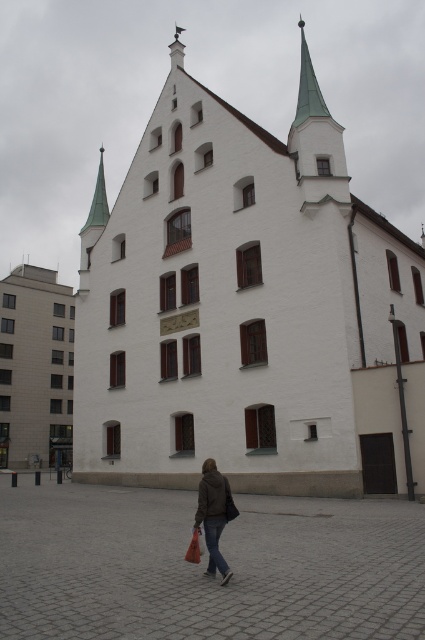
Question: Can you confirm if gray cobblestone square at center is positioned below brown leather jacket at lower center?

Choices:
 (A) yes
 (B) no

Answer: (A)

Question: Which of the following is the closest to the observer?

Choices:
 (A) white concrete building at left
 (B) gray cobblestone square at center
 (C) white stone church at center
 (D) brown leather jacket at lower center

Answer: (B)

Question: Which of these objects is positioned closest to the gray cobblestone square at center?

Choices:
 (A) white stone church at center
 (B) brown leather jacket at lower center
 (C) white concrete building at left

Answer: (B)

Question: Does white stone church at center appear on the left side of brown leather jacket at lower center?

Choices:
 (A) no
 (B) yes

Answer: (A)

Question: Is white stone church at center smaller than brown leather jacket at lower center?

Choices:
 (A) yes
 (B) no

Answer: (B)

Question: Based on their relative distances, which object is nearer to the brown leather jacket at lower center?

Choices:
 (A) gray cobblestone square at center
 (B) white stone church at center

Answer: (A)